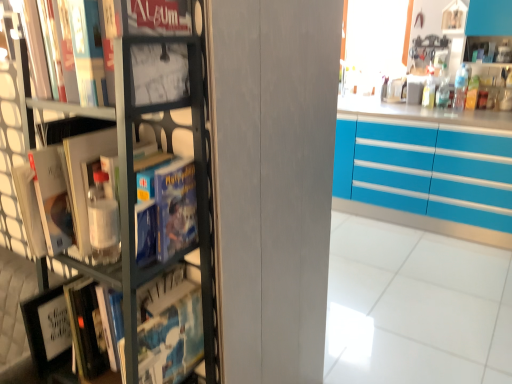
Question: From a real-world perspective, is metallic gray bookcase at left positioned over matte black book at upper left based on gravity?

Choices:
 (A) yes
 (B) no

Answer: (B)

Question: Does metallic gray bookcase at left appear on the right side of matte black book at upper left?

Choices:
 (A) yes
 (B) no

Answer: (B)

Question: Does metallic gray bookcase at left appear on the left side of matte black book at upper left?

Choices:
 (A) yes
 (B) no

Answer: (A)

Question: Is metallic gray bookcase at left aimed at matte black book at upper left?

Choices:
 (A) no
 (B) yes

Answer: (A)

Question: Considering the relative sizes of metallic gray bookcase at left and matte black book at upper left in the image provided, is metallic gray bookcase at left wider than matte black book at upper left?

Choices:
 (A) yes
 (B) no

Answer: (A)

Question: Does metallic gray bookcase at left come in front of matte black book at upper left?

Choices:
 (A) yes
 (B) no

Answer: (A)

Question: From the image's perspective, would you say turquoise glossy cabinets at right is positioned over metallic gray bookcase at left?

Choices:
 (A) yes
 (B) no

Answer: (A)

Question: Is turquoise glossy cabinets at right to the right of metallic gray bookcase at left from the viewer's perspective?

Choices:
 (A) yes
 (B) no

Answer: (A)

Question: Is turquoise glossy cabinets at right thinner than metallic gray bookcase at left?

Choices:
 (A) yes
 (B) no

Answer: (B)

Question: Is turquoise glossy cabinets at right positioned in front of metallic gray bookcase at left?

Choices:
 (A) yes
 (B) no

Answer: (B)

Question: From the image's perspective, is turquoise glossy cabinets at right under metallic gray bookcase at left?

Choices:
 (A) no
 (B) yes

Answer: (A)

Question: Is turquoise glossy cabinets at right looking in the opposite direction of metallic gray bookcase at left?

Choices:
 (A) no
 (B) yes

Answer: (A)

Question: Could turquoise glossy cabinets at right be considered to be inside matte black book at upper left?

Choices:
 (A) yes
 (B) no

Answer: (B)